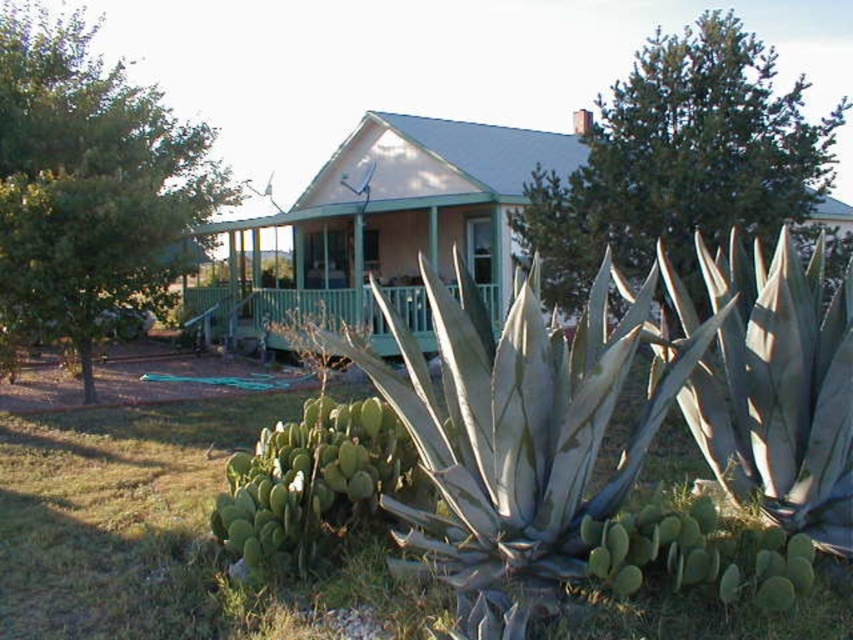
You are standing in front of the house and notice two green leafy trees. One is labeled as the green leafy tree at left and the other as the green leafy tree at upper center. Which tree is positioned higher in the frame?

The green leafy tree at upper center is positioned higher in the frame than the green leafy tree at left.

You are standing in front of the house and want to plant a new tree exactly where the green leafy tree at left is currently located. What are the coordinates of the spot where you should plant the new tree?

The coordinates for the green leafy tree at left are at point (90, 182), so you should plant the new tree at those coordinates.